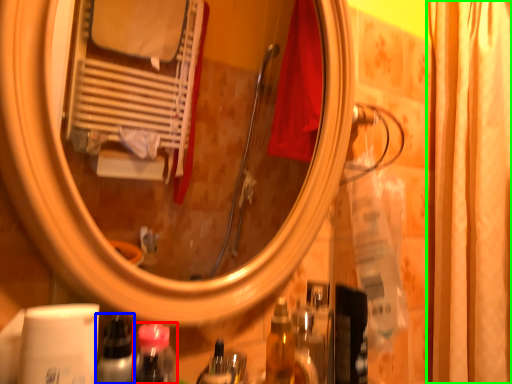
Question: Estimate the real-world distances between objects in this image. Which object is closer to mouthwash (highlighted by a red box), bottle (highlighted by a blue box) or shower curtain (highlighted by a green box)?

Choices:
 (A) bottle
 (B) shower curtain

Answer: (A)